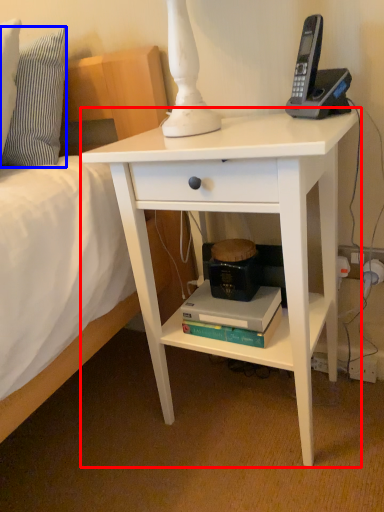
Question: Which of the following is the farthest to the observer, desk (highlighted by a red box) or pillow (highlighted by a blue box)?

Choices:
 (A) desk
 (B) pillow

Answer: (B)